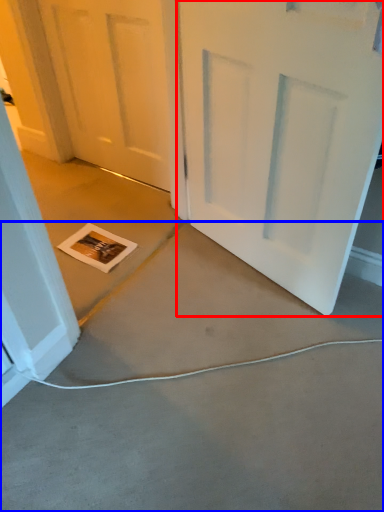
Question: Which object is further to the camera taking this photo, door (highlighted by a red box) or concrete (highlighted by a blue box)?

Choices:
 (A) door
 (B) concrete

Answer: (A)